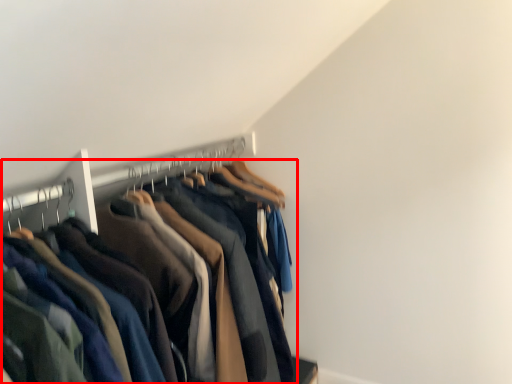
Question: From the image's perspective, what is the correct spatial relationship of trousers (annotated by the red box) in relation to hanger?

Choices:
 (A) below
 (B) above

Answer: (A)